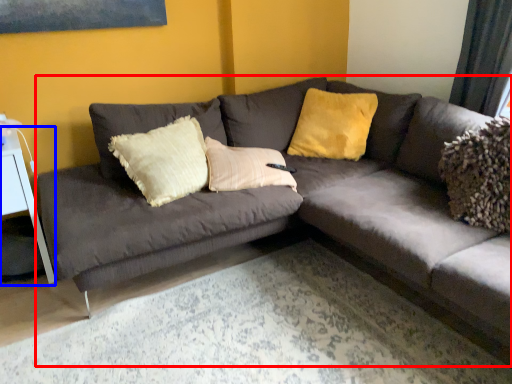
Question: Which of the following is the farthest to the observer, studio couch (highlighted by a red box) or table (highlighted by a blue box)?

Choices:
 (A) studio couch
 (B) table

Answer: (B)